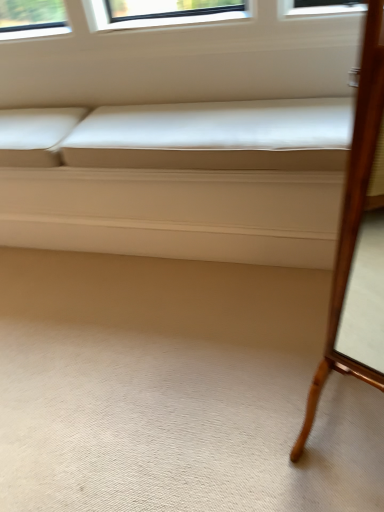
Question: Is white leather couch at center at the left side of wooden mirror at right?

Choices:
 (A) yes
 (B) no

Answer: (A)

Question: Would you say wooden mirror at right is part of white leather couch at center's contents?

Choices:
 (A) no
 (B) yes

Answer: (A)

Question: Can you confirm if white leather couch at center is bigger than wooden mirror at right?

Choices:
 (A) no
 (B) yes

Answer: (B)

Question: Does white leather couch at center have a lesser height compared to wooden mirror at right?

Choices:
 (A) yes
 (B) no

Answer: (A)

Question: From a real-world perspective, is white leather couch at center located higher than wooden mirror at right?

Choices:
 (A) yes
 (B) no

Answer: (B)

Question: Is white leather couch at center at the right side of wooden mirror at right?

Choices:
 (A) no
 (B) yes

Answer: (A)

Question: Is wooden mirror at right outside of white leather couch at center?

Choices:
 (A) yes
 (B) no

Answer: (A)

Question: From the image's perspective, is wooden mirror at right above white leather couch at center?

Choices:
 (A) yes
 (B) no

Answer: (B)

Question: Considering the relative sizes of wooden mirror at right and white leather couch at center in the image provided, is wooden mirror at right thinner than white leather couch at center?

Choices:
 (A) no
 (B) yes

Answer: (B)

Question: From a real-world perspective, is wooden mirror at right positioned over white leather couch at center based on gravity?

Choices:
 (A) no
 (B) yes

Answer: (B)

Question: Is wooden mirror at right at the right side of white leather couch at center?

Choices:
 (A) yes
 (B) no

Answer: (A)

Question: Can you confirm if wooden mirror at right is positioned to the left of white leather couch at center?

Choices:
 (A) yes
 (B) no

Answer: (B)

Question: Considering the positions of white leather couch at center and wooden mirror at right in the image, is white leather couch at center bigger or smaller than wooden mirror at right?

Choices:
 (A) small
 (B) big

Answer: (B)